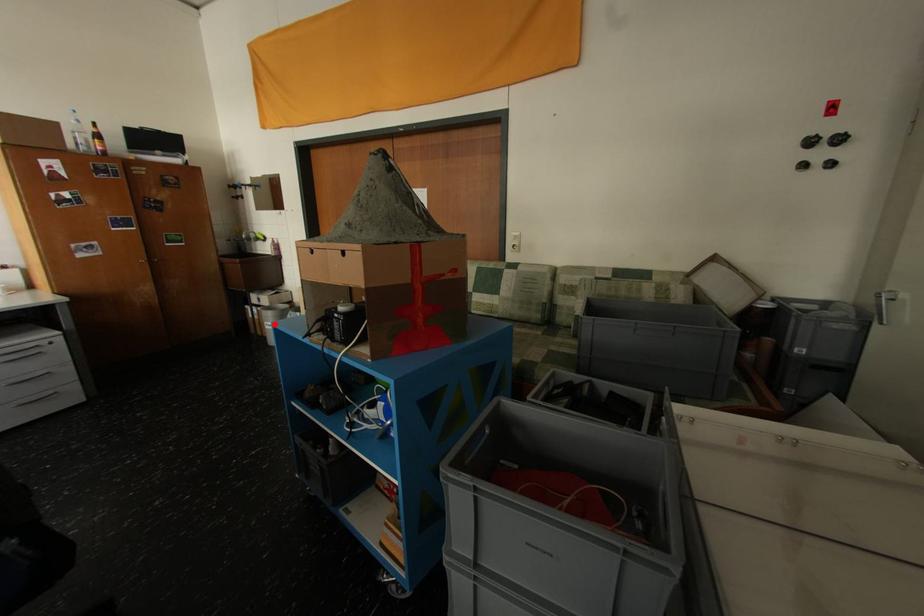
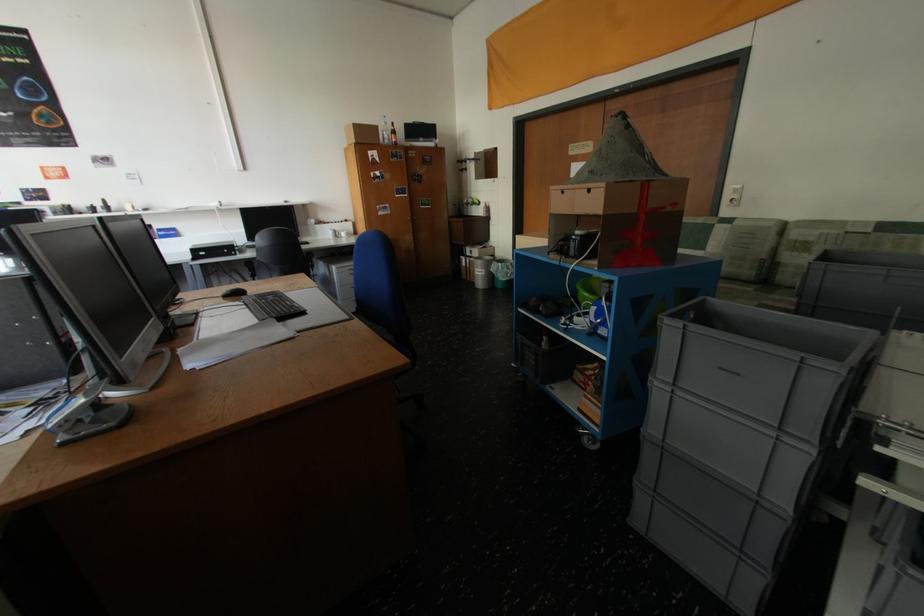
Question: A red point is marked in image1. In image2, is the corresponding 3D point closer to the camera or farther? Reply with the corresponding letter.

Choices:
 (A) The corresponding 3D point is closer.
 (B) The corresponding 3D point is farther.

Answer: (A)